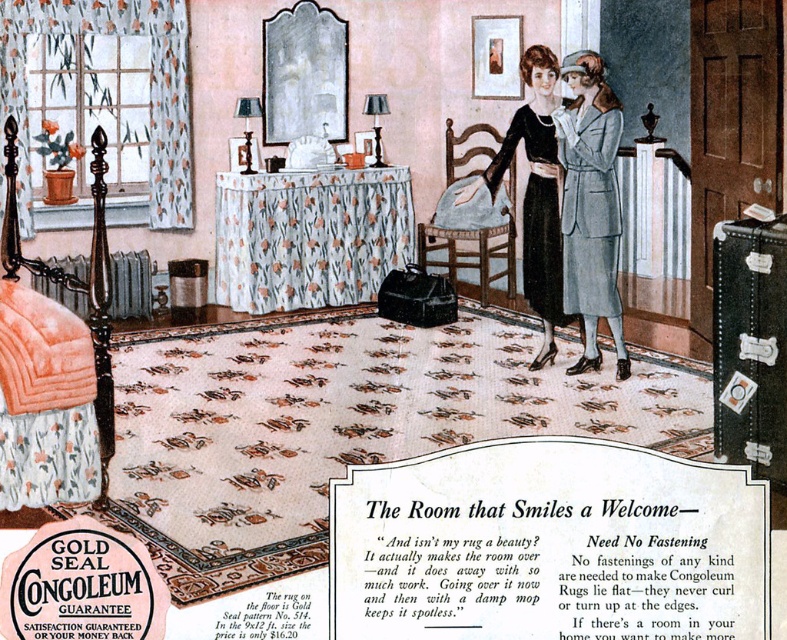
You are standing at point (475, 452) in the room. You want to walk to the radiator located 2.40 meters away. Is there enough space to move freely between the area rug with a floral pattern in muted tones of beige, brown, and green and the radiator?

The distance between you and the radiator is 2.40 meters. Since the area rug with a floral pattern in muted tones of beige, brown, and green covers most of the floor space, there is likely enough space to move freely to the radiator unless the rug is obstructing the path.